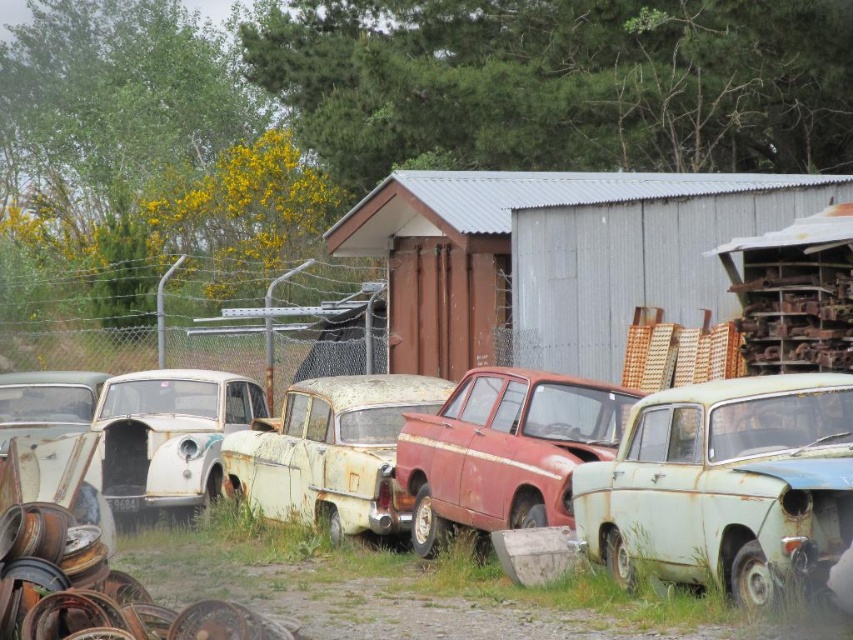
Question: Based on their relative distances, which object is farther from the green matte car at lower right?

Choices:
 (A) rusty metal car at center
 (B) rusty metal car at left

Answer: (B)

Question: Considering the relative positions of rusty corrugated metal hut at center and rusty metal car at left in the image provided, where is rusty corrugated metal hut at center located with respect to rusty metal car at left?

Choices:
 (A) below
 (B) above

Answer: (B)

Question: Which of the following is the farthest from the observer?

Choices:
 (A) green matte car at lower right
 (B) rusty metal car at center

Answer: (B)

Question: Which point is farther from the camera taking this photo?

Choices:
 (A) (498, 376)
 (B) (819, 509)

Answer: (A)

Question: Is rusty corrugated metal hut at center to the right of rusty matte car at center from the viewer's perspective?

Choices:
 (A) no
 (B) yes

Answer: (B)

Question: Does rusty corrugated metal hut at center have a lesser width compared to rusty metal car at center?

Choices:
 (A) yes
 (B) no

Answer: (A)